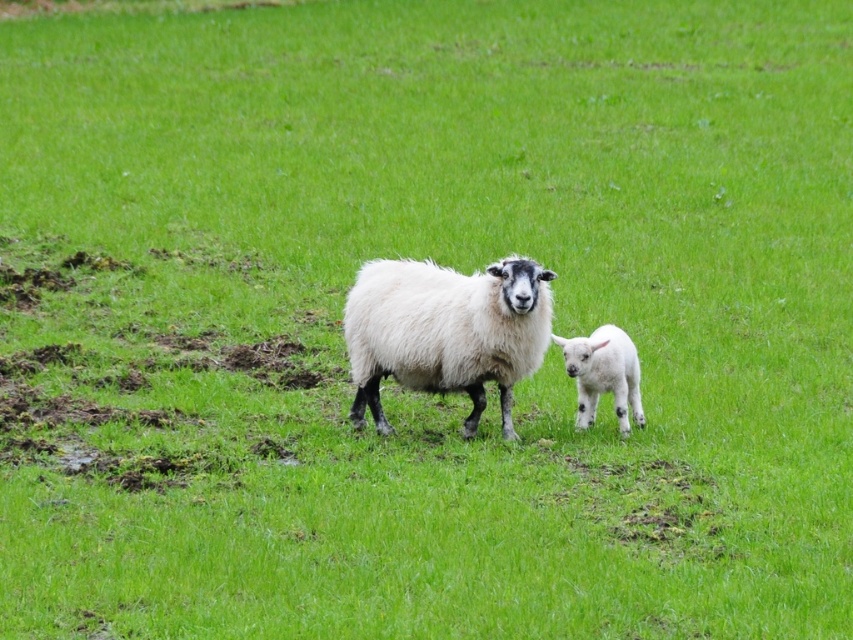
You are a farmer checking the field. You notice the white woolly sheep at center and the white fluffy lamb at right. Which one is higher up in the image?

The white woolly sheep at center is higher up in the image than the white fluffy lamb at right.